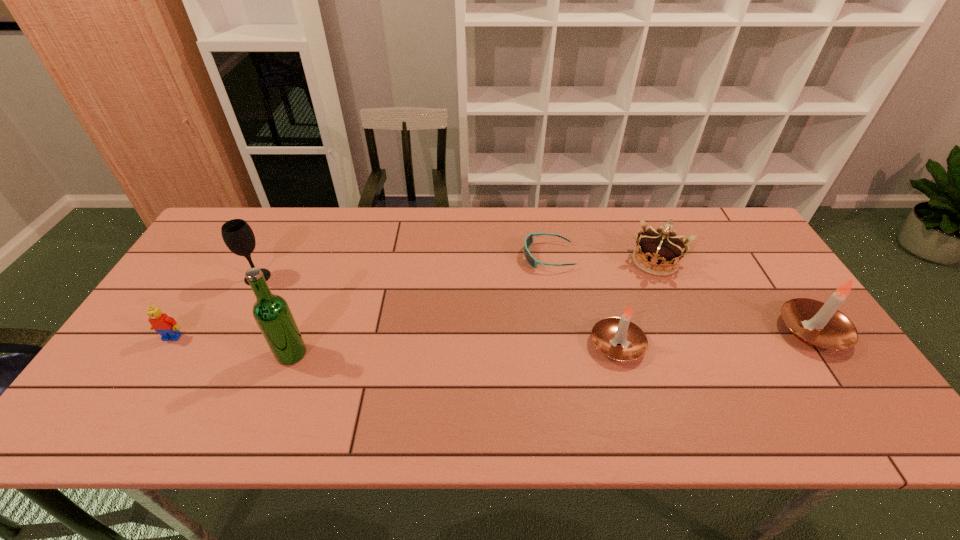
Identify the location of vacant space that is in between the crown and the fifth object from right to left. (473, 307).

Locate an element on the screen. Image resolution: width=960 pixels, height=540 pixels. empty space between the shortest object and the sixth object from right to left is located at coordinates (403, 267).

At what (x,y) coordinates should I click in order to perform the action: click on unoccupied area between the Lego and the left candle. Please return your answer as a coordinate pair (x, y). The width and height of the screenshot is (960, 540). Looking at the image, I should click on (395, 341).

Find the location of `free space between the rightmost object and the shortest object`. free space between the rightmost object and the shortest object is located at coordinates (680, 294).

Locate an element on the screen. The width and height of the screenshot is (960, 540). free spot between the Lego and the left candle is located at coordinates (395, 341).

Find the location of a particular element. This screenshot has height=540, width=960. vacant area that lies between the shortest object and the third object from left to right is located at coordinates (420, 305).

Identify the location of free space between the crown and the leftmost object. (414, 299).

What are the coordinates of `vacant area that lies between the fifth object from right to left and the second object from right to left` in the screenshot? It's located at (473, 307).

The image size is (960, 540). What are the coordinates of `object that is the second closest to the beer bottle` in the screenshot? It's located at (167, 327).

Select which object is the sixth closest to the sunglasses. Please provide its 2D coordinates. Your answer should be formatted as a tuple, i.e. [(x, y)], where the tuple contains the x and y coordinates of a point satisfying the conditions above.

[(167, 327)]